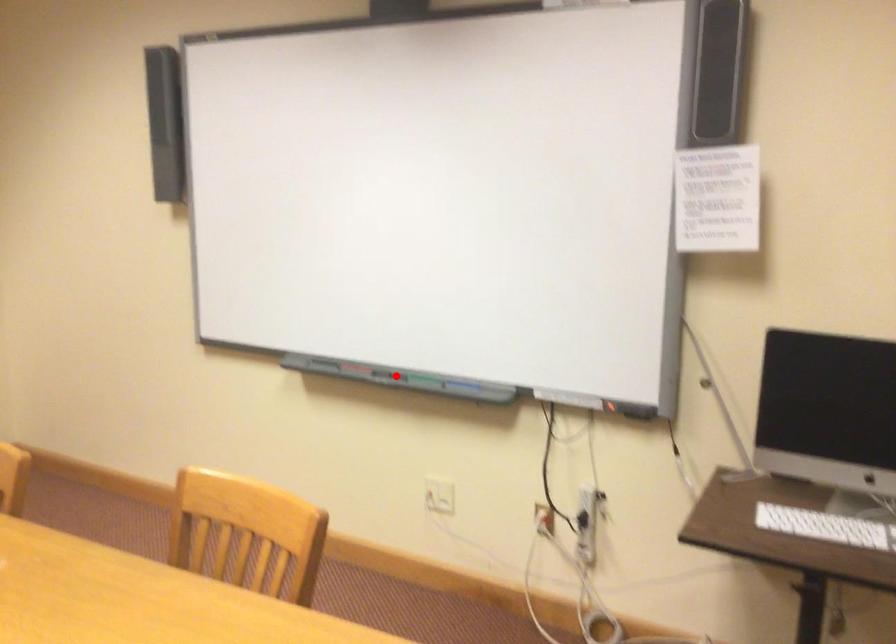
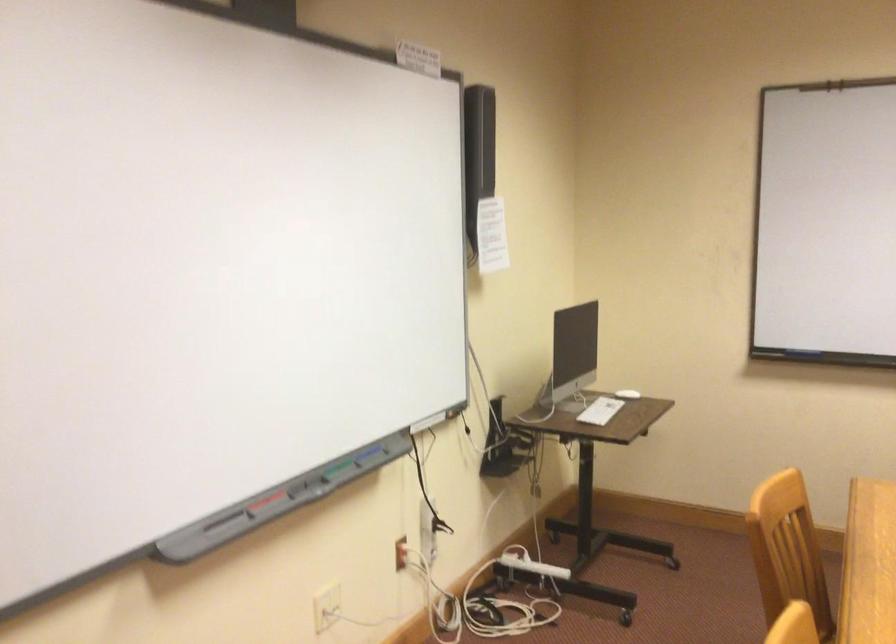
Question: I am providing you with two images of the same scene from different viewpoints. A red point is marked on the first image. Can you still see the location of the red point in image 2?

Choices:
 (A) Yes
 (B) No

Answer: (A)